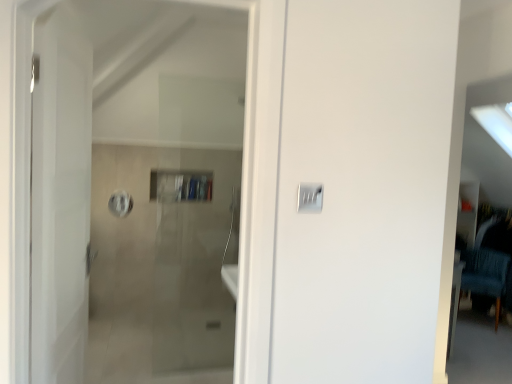
Question: From a real-world perspective, relative to satin silver switch at center, is white glossy door at left vertically above or below?

Choices:
 (A) below
 (B) above

Answer: (A)

Question: Choose the correct answer: Is white glossy door at left inside satin silver switch at center or outside it?

Choices:
 (A) outside
 (B) inside

Answer: (A)

Question: Which of these objects is positioned closest to the blue fabric chair at right?

Choices:
 (A) white glossy door at left
 (B) satin silver switch at center

Answer: (B)

Question: Considering the real-world distances, which object is closest to the satin silver switch at center?

Choices:
 (A) blue fabric chair at right
 (B) white glossy door at left

Answer: (B)